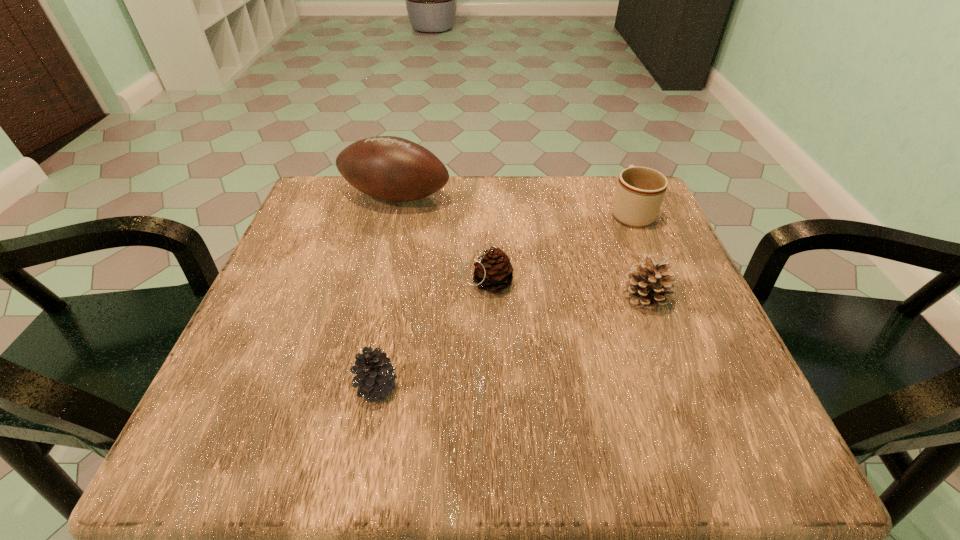
Identify the location of vacant area that lies between the second pinecone from right to left and the rightmost pinecone. (566, 290).

In order to click on vacant area between the nearest pinecone and the mug in this screenshot , I will do `click(504, 300)`.

This screenshot has width=960, height=540. In order to click on vacant area between the third object from left to right and the nearest object in this screenshot , I will do `click(432, 335)`.

Find the location of a particular element. vacant area that lies between the leftmost pinecone and the mug is located at coordinates (504, 300).

The width and height of the screenshot is (960, 540). What are the coordinates of `object that stands as the second closest to the nearest object` in the screenshot? It's located at (647, 284).

Identify which object is the third closest to the second pinecone from right to left. Please provide its 2D coordinates. Your answer should be formatted as a tuple, i.e. [(x, y)], where the tuple contains the x and y coordinates of a point satisfying the conditions above.

[(647, 284)]

Locate an element on the screen. The height and width of the screenshot is (540, 960). the closest pinecone relative to the third object from right to left is located at coordinates (375, 377).

Locate which pinecone ranks second in proximity to the nearest pinecone. Please provide its 2D coordinates. Your answer should be formatted as a tuple, i.e. [(x, y)], where the tuple contains the x and y coordinates of a point satisfying the conditions above.

[(647, 284)]

This screenshot has width=960, height=540. Identify the location of vacant position in the image that satisfies the following two spatial constraints: 1. with a leaf charm attached to the second pinecone from right to left; 2. on the front side of the nearest pinecone. (490, 388).

Find the location of a particular element. The height and width of the screenshot is (540, 960). vacant space that satisfies the following two spatial constraints: 1. on the back side of the rightmost pinecone; 2. on the left side of the nearest pinecone is located at coordinates (395, 297).